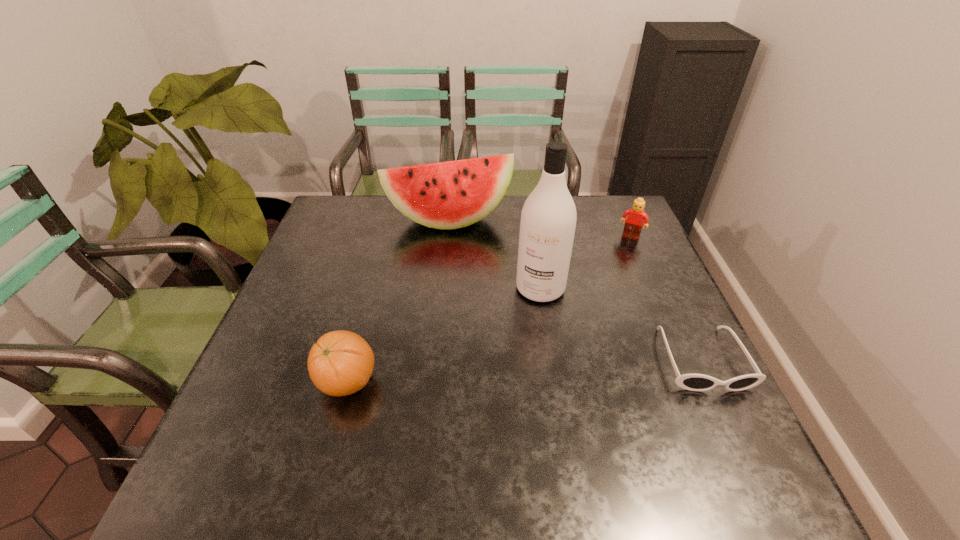
The width and height of the screenshot is (960, 540). I want to click on orange, so click(340, 363).

At what (x,y) coordinates should I click in order to perform the action: click on the shortest object. Please return your answer as a coordinate pair (x, y). Looking at the image, I should click on pos(694,382).

Where is `Lego`? Image resolution: width=960 pixels, height=540 pixels. Lego is located at coordinates (637, 216).

Find the location of a particular element. Image resolution: width=960 pixels, height=540 pixels. shampoo is located at coordinates pyautogui.click(x=548, y=220).

You are a GUI agent. You are given a task and a screenshot of the screen. Output one action in this format:
    pyautogui.click(x=<x>, y=<y>)
    Task: Click on the tallest object
    The width and height of the screenshot is (960, 540).
    Given the screenshot: What is the action you would take?
    pyautogui.click(x=548, y=220)

Where is `the fourth shortest object`? The width and height of the screenshot is (960, 540). the fourth shortest object is located at coordinates (447, 195).

The image size is (960, 540). What are the coordinates of `vacant space located on the back of the orange` in the screenshot? It's located at (372, 291).

Image resolution: width=960 pixels, height=540 pixels. Find the location of `free space located on the face of the Lego`. free space located on the face of the Lego is located at coordinates (592, 319).

You are a GUI agent. You are given a task and a screenshot of the screen. Output one action in this format:
    pyautogui.click(x=<x>, y=<y>)
    Task: Click on the blank area located 0.050m on the face of the Lego
    The height and width of the screenshot is (540, 960).
    Given the screenshot: What is the action you would take?
    pyautogui.click(x=623, y=250)

Where is `vacant position located on the face of the Lego`? The height and width of the screenshot is (540, 960). vacant position located on the face of the Lego is located at coordinates (598, 306).